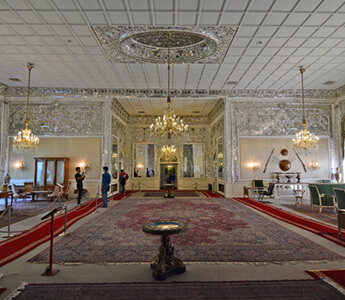
This screenshot has height=300, width=345. I want to click on large vertical rectangular red, black, and beige rug, so click(x=203, y=224).